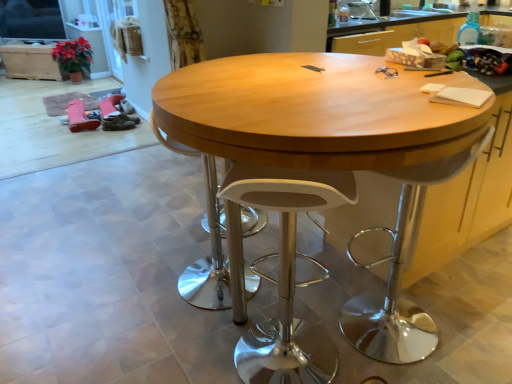
Find the location of a particular element. free spot behind white plastic stool at center is located at coordinates (293, 303).